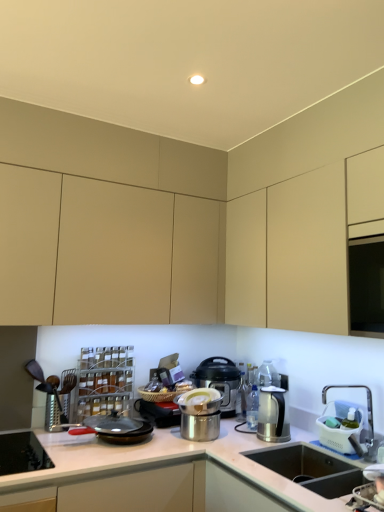
Question: From a real-world perspective, is black non-stick frying pan at center under matte beige cabinet at center, acting as the 2th cabinetry starting from the back?

Choices:
 (A) yes
 (B) no

Answer: (A)

Question: Is black non-stick frying pan at center shorter than matte beige cabinet at center, the 1th cabinetry in the front-to-back sequence?

Choices:
 (A) no
 (B) yes

Answer: (B)

Question: From the image's perspective, does black non-stick frying pan at center appear higher than matte beige cabinet at center, acting as the 2th cabinetry starting from the back?

Choices:
 (A) yes
 (B) no

Answer: (B)

Question: Is black non-stick frying pan at center closer to camera compared to matte beige cabinet at center, acting as the 2th cabinetry starting from the back?

Choices:
 (A) yes
 (B) no

Answer: (B)

Question: Considering the relative positions of black non-stick frying pan at center and matte beige cabinet at center, acting as the 2th cabinetry starting from the back, in the image provided, is black non-stick frying pan at center behind matte beige cabinet at center, acting as the 2th cabinetry starting from the back,?

Choices:
 (A) no
 (B) yes

Answer: (B)

Question: Does black non-stick frying pan at center have a lesser width compared to matte beige cabinet at center, acting as the 2th cabinetry starting from the back?

Choices:
 (A) no
 (B) yes

Answer: (B)

Question: From a real-world perspective, is matte black pressure cooker at center, which is counted as the 3th kitchen appliance, starting from the front, located higher than polished stainless steel pot at center, the first kitchen appliance viewed from the front?

Choices:
 (A) no
 (B) yes

Answer: (B)

Question: Can polished stainless steel pot at center, the third kitchen appliance viewed from the back, be found inside matte black pressure cooker at center, which is counted as the 3th kitchen appliance, starting from the front?

Choices:
 (A) yes
 (B) no

Answer: (B)

Question: Is matte black pressure cooker at center, arranged as the first kitchen appliance when viewed from the back, aimed at polished stainless steel pot at center, the first kitchen appliance viewed from the front?

Choices:
 (A) no
 (B) yes

Answer: (B)

Question: Can you confirm if matte black pressure cooker at center, arranged as the first kitchen appliance when viewed from the back, is taller than polished stainless steel pot at center, the first kitchen appliance viewed from the front?

Choices:
 (A) no
 (B) yes

Answer: (B)

Question: Is matte black pressure cooker at center, arranged as the first kitchen appliance when viewed from the back, behind polished stainless steel pot at center, the first kitchen appliance viewed from the front?

Choices:
 (A) no
 (B) yes

Answer: (B)

Question: From a real-world perspective, does matte black pressure cooker at center, arranged as the first kitchen appliance when viewed from the back, sit lower than polished stainless steel pot at center, the third kitchen appliance viewed from the back?

Choices:
 (A) no
 (B) yes

Answer: (A)

Question: Does satin silver kettle at right, marked as the 2th kitchen appliance in a back-to-front arrangement, have a lesser width compared to brushed metal grater at left?

Choices:
 (A) no
 (B) yes

Answer: (B)